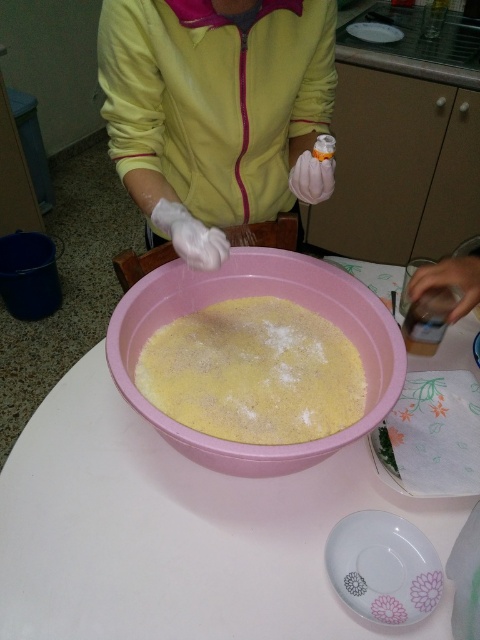
Consider the image. Between white plastic table at center and porcelain plate at lower center, which one is positioned lower?

porcelain plate at lower center is lower down.

Does white plastic table at center have a smaller size compared to porcelain plate at lower center?

No, white plastic table at center is not smaller than porcelain plate at lower center.

Identify the location of white plastic table at center. The height and width of the screenshot is (640, 480). (179, 532).

Measure the distance from white plastic table at center to pink plastic bowl at center.

white plastic table at center and pink plastic bowl at center are 6.11 inches apart from each other.

From the picture: Who is shorter, white plastic table at center or pink plastic bowl at center?

pink plastic bowl at center

Is point (37, 509) in front of point (127, 353)?

No, it is behind (127, 353).

Where is `white plastic table at center`? This screenshot has width=480, height=640. white plastic table at center is located at coordinates (179, 532).

Does white plastic table at center lie behind white glossy plate at upper center?

No, white plastic table at center is in front of white glossy plate at upper center.

Consider the image. How distant is white plastic table at center from white glossy plate at upper center?

white plastic table at center is 5.35 feet from white glossy plate at upper center.

What do you see at coordinates (179, 532) in the screenshot?
I see `white plastic table at center` at bounding box center [179, 532].

You are a GUI agent. You are given a task and a screenshot of the screen. Output one action in this format:
    pyautogui.click(x=<x>, y=<y>)
    Task: Click on the white plastic table at center
    
    Given the screenshot: What is the action you would take?
    pyautogui.click(x=179, y=532)